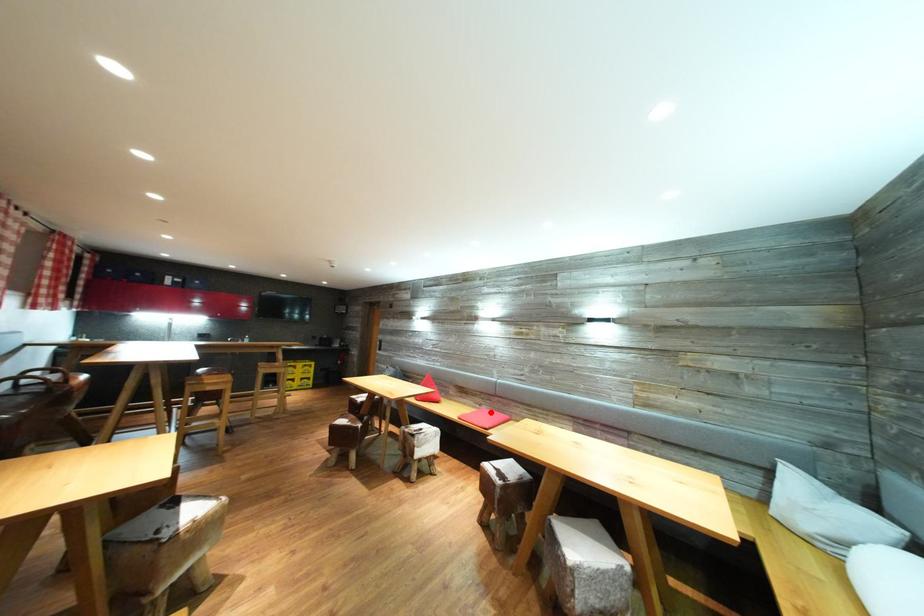
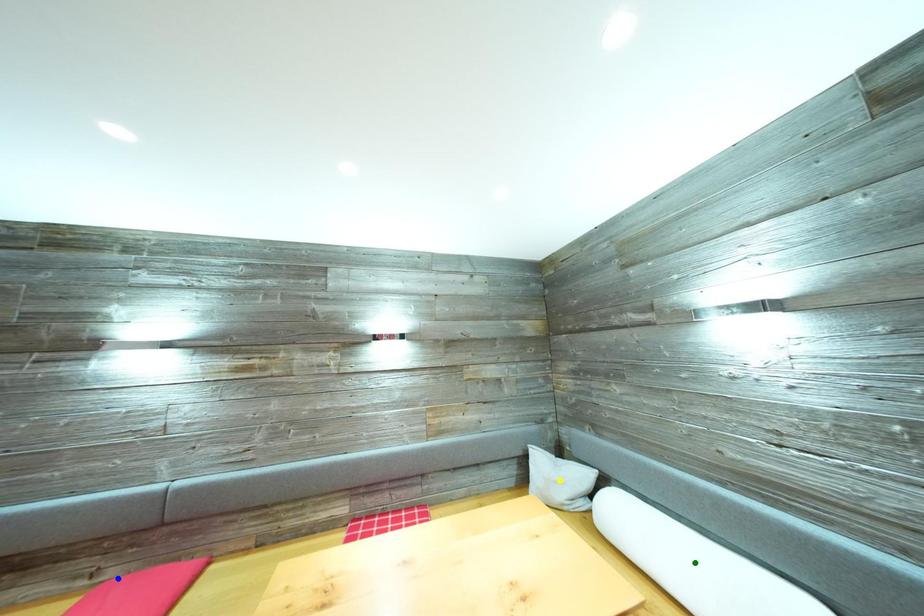
Question: I am providing you with two images of the same scene from different viewpoints. A red point is marked on the first image. You are given multiple points on the second image. In image 2, which mark is for the same physical point as the one in image 1?

Choices:
 (A) green point
 (B) yellow point
 (C) blue point

Answer: (C)